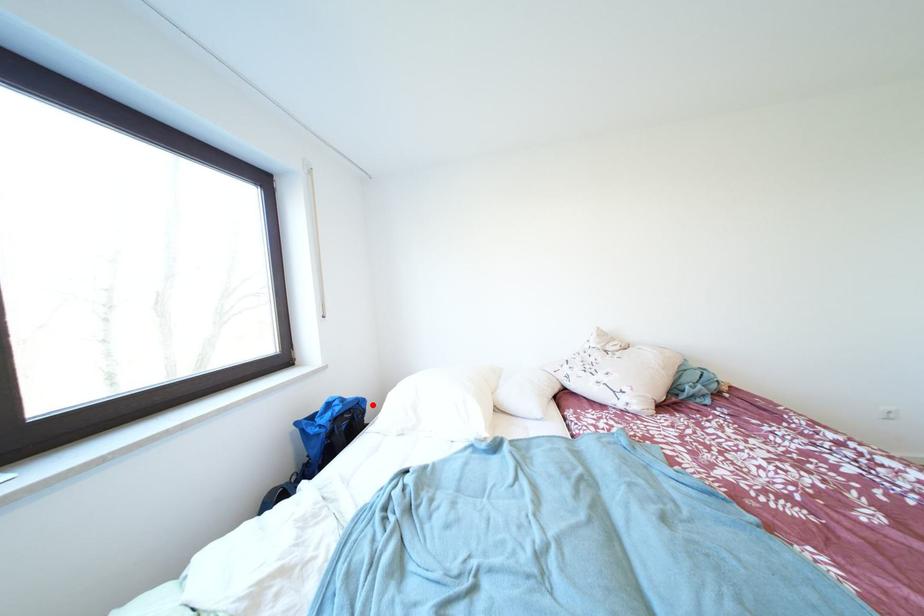
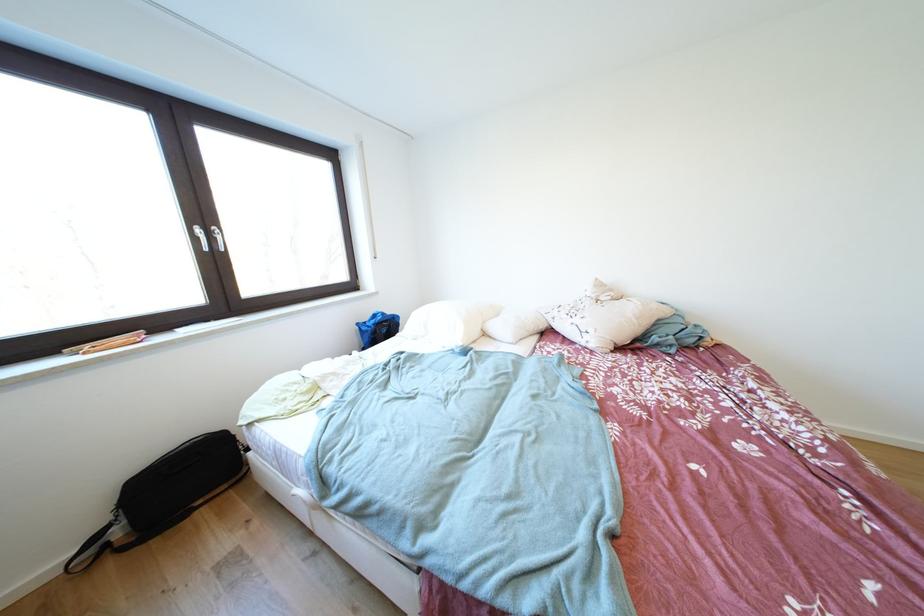
Where in the second image is the point corresponding to the highlighted location from the first image?

(407, 321)